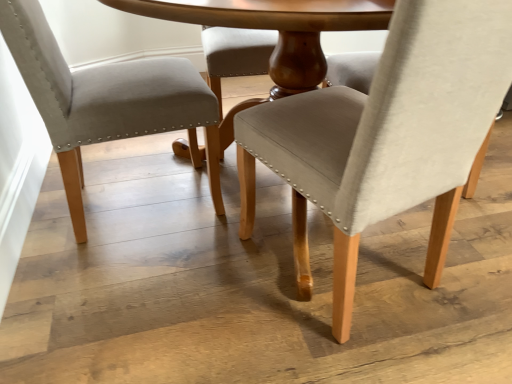
You are a GUI agent. You are given a task and a screenshot of the screen. Output one action in this format:
    pyautogui.click(x=<x>, y=<y>)
    Task: Click on the vacant space underneath beige fabric chair at left, which is the 2th chair from right to left (from a real-world perspective)
    This screenshot has width=512, height=384.
    Given the screenshot: What is the action you would take?
    pyautogui.click(x=134, y=197)